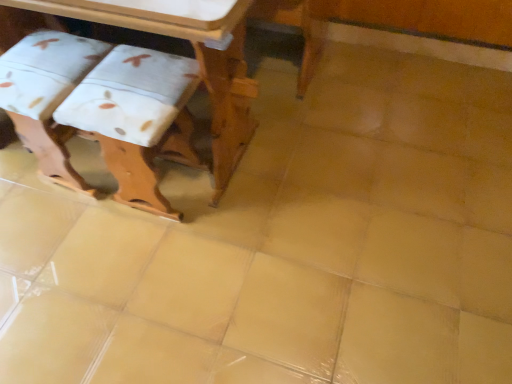
This screenshot has height=384, width=512. Find the location of `free space in front of white fabric step stool at left, which is counted as the second step stool, starting from the left`. free space in front of white fabric step stool at left, which is counted as the second step stool, starting from the left is located at coordinates (154, 261).